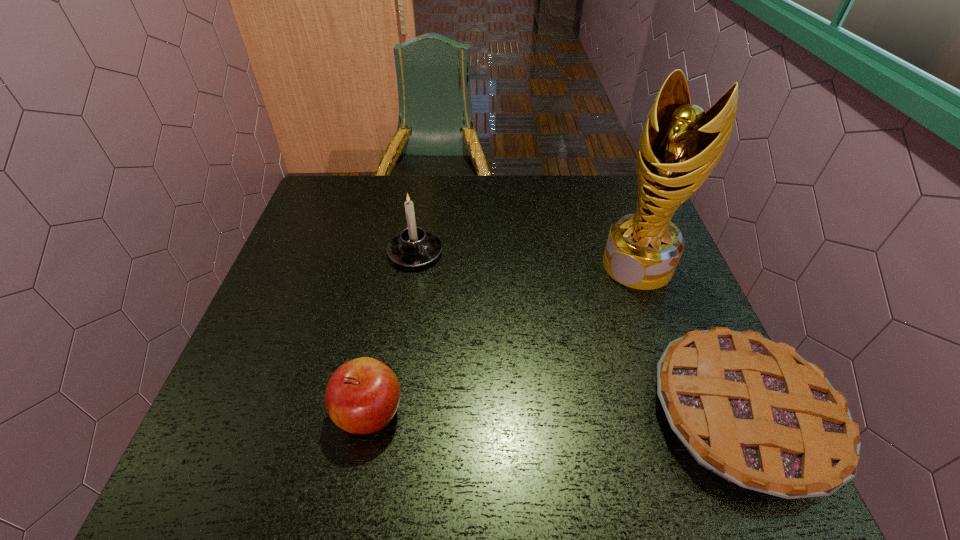
This screenshot has width=960, height=540. Find the location of `free space on the desktop that is between the second shortest object and the pie and is positioned on the front-facing side of the tallest object`. free space on the desktop that is between the second shortest object and the pie and is positioned on the front-facing side of the tallest object is located at coordinates (508, 413).

Identify the location of vacant spot on the desktop that is between the apple and the pie and is positioned with a handle on the side of the candle holder. (598, 414).